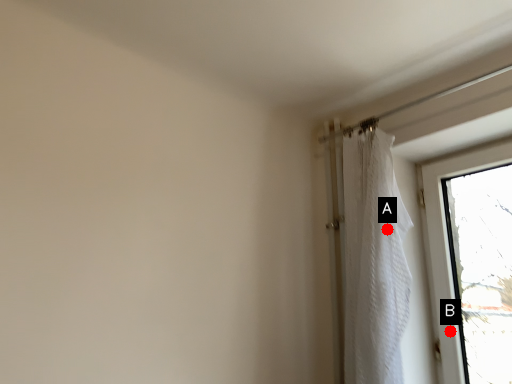
Question: Two points are circled on the image, labeled by A and B beside each circle. Which of the following is the closest to the observer?

Choices:
 (A) A is closer
 (B) B is closer

Answer: (A)